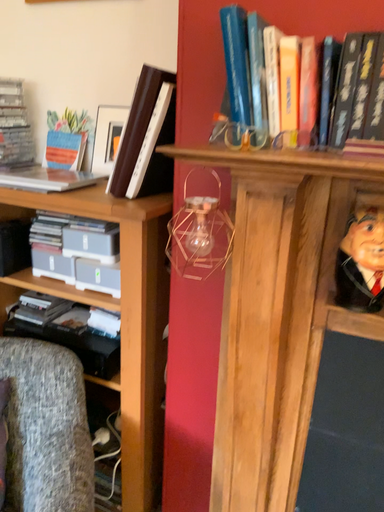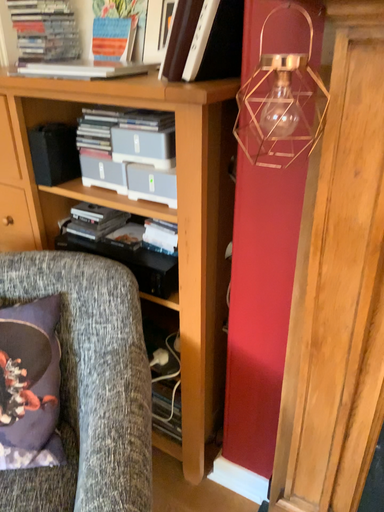
Question: How did the camera likely rotate when shooting the video?

Choices:
 (A) rotated downward
 (B) rotated upward

Answer: (A)